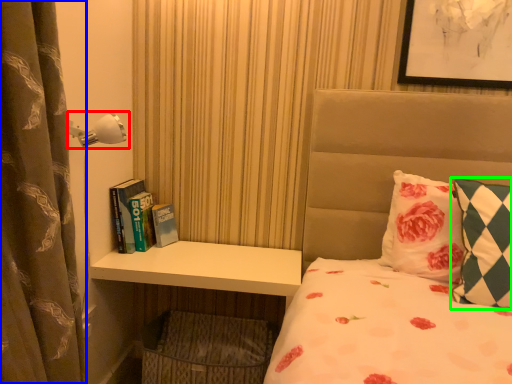
Question: Estimate the real-world distances between objects in this image. Which object is closer to lamp (highlighted by a red box), curtain (highlighted by a blue box) or pillow (highlighted by a green box)?

Choices:
 (A) curtain
 (B) pillow

Answer: (A)